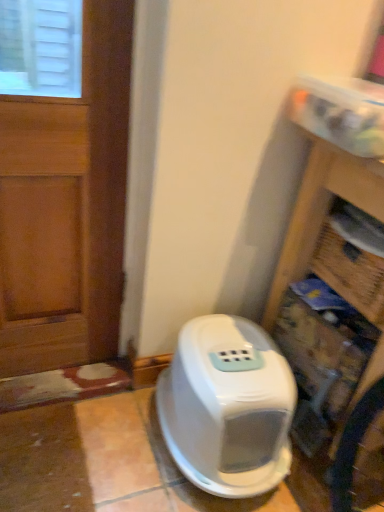
At what (x,y) coordinates should I click in order to perform the action: click on free region on the left part of white plastic litter box at lower center. Please return your answer as a coordinate pair (x, y). Looking at the image, I should click on (105, 451).